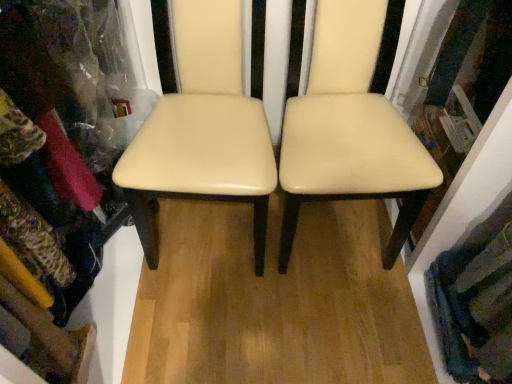
What do you see at coordinates (475, 301) in the screenshot? This screenshot has height=384, width=512. I see `textured wool scarf at lower right` at bounding box center [475, 301].

The width and height of the screenshot is (512, 384). What are the coordinates of `cream leather chair at center, placed as the second chair when sorted from right to left` in the screenshot? It's located at (202, 128).

Describe the element at coordinates (350, 129) in the screenshot. The height and width of the screenshot is (384, 512). I see `creamy leather chair at center, the 1th chair from the right` at that location.

You are a GUI agent. You are given a task and a screenshot of the screen. Output one action in this format:
    pyautogui.click(x=<x>, y=<y>)
    Task: Click on the textured wool scarf at lower right
    Image resolution: width=512 pixels, height=384 pixels.
    Given the screenshot: What is the action you would take?
    pyautogui.click(x=475, y=301)

Which is closer to the camera, (419, 183) or (450, 326)?

Point (419, 183) is closer to the camera than point (450, 326).

I want to click on clothing located below the creamy leather chair at center, which ranks as the 2th chair in left-to-right order (from the image's perspective), so click(x=475, y=301).

Is creamy leather chair at center, which ranks as the 2th chair in left-to-right order, surrounding textured wool scarf at lower right?

No, textured wool scarf at lower right is not a part of creamy leather chair at center, which ranks as the 2th chair in left-to-right order.

Looking at this image, is creamy leather chair at center, the 1th chair from the right, thinner than textured wool scarf at lower right?

No.

From the picture: Measure the distance from cream leather chair at center, placed as the second chair when sorted from right to left, to creamy leather chair at center, which ranks as the 2th chair in left-to-right order.

cream leather chair at center, placed as the second chair when sorted from right to left, is 10.68 inches away from creamy leather chair at center, which ranks as the 2th chair in left-to-right order.

In terms of width, does cream leather chair at center, which is counted as the 1th chair, starting from the left, look wider or thinner when compared to creamy leather chair at center, the 1th chair from the right?

cream leather chair at center, which is counted as the 1th chair, starting from the left, is thinner than creamy leather chair at center, the 1th chair from the right.

In the scene shown: Is cream leather chair at center, which is counted as the 1th chair, starting from the left, at the right side of creamy leather chair at center, which ranks as the 2th chair in left-to-right order?

Incorrect, cream leather chair at center, which is counted as the 1th chair, starting from the left, is not on the right side of creamy leather chair at center, which ranks as the 2th chair in left-to-right order.

Is cream leather chair at center, which is counted as the 1th chair, starting from the left, taller or shorter than creamy leather chair at center, which ranks as the 2th chair in left-to-right order?

In the image, cream leather chair at center, which is counted as the 1th chair, starting from the left, appears to be shorter than creamy leather chair at center, which ranks as the 2th chair in left-to-right order.

How far apart are textured wool scarf at lower right and creamy leather chair at center, which ranks as the 2th chair in left-to-right order?

textured wool scarf at lower right and creamy leather chair at center, which ranks as the 2th chair in left-to-right order, are 15.21 inches apart.

From the image's perspective, between textured wool scarf at lower right and creamy leather chair at center, the 1th chair from the right, which one is located above?

creamy leather chair at center, the 1th chair from the right, is shown above in the image.

Considering the positions of point (507, 348) and point (317, 50), is point (507, 348) closer or farther from the camera than point (317, 50)?

Point (507, 348) is positioned closer to the camera compared to point (317, 50).

Is there a large distance between textured wool scarf at lower right and creamy leather chair at center, which ranks as the 2th chair in left-to-right order?

textured wool scarf at lower right is actually quite close to creamy leather chair at center, which ranks as the 2th chair in left-to-right order.

Considering the sizes of objects textured wool scarf at lower right and cream leather chair at center, which is counted as the 1th chair, starting from the left, in the image provided, who is wider, textured wool scarf at lower right or cream leather chair at center, which is counted as the 1th chair, starting from the left,?

With larger width is cream leather chair at center, which is counted as the 1th chair, starting from the left.

Are textured wool scarf at lower right and cream leather chair at center, placed as the second chair when sorted from right to left, far apart?

They are positioned close to each other.

Is point (432, 305) closer or farther from the camera than point (219, 117)?

Clearly, point (432, 305) is more distant from the camera than point (219, 117).

Who is more distant, textured wool scarf at lower right or cream leather chair at center, which is counted as the 1th chair, starting from the left?

Positioned behind is textured wool scarf at lower right.

Are creamy leather chair at center, the 1th chair from the right, and cream leather chair at center, which is counted as the 1th chair, starting from the left, beside each other?

creamy leather chair at center, the 1th chair from the right, is not next to cream leather chair at center, which is counted as the 1th chair, starting from the left, and they're not touching.

Could you tell me if creamy leather chair at center, which ranks as the 2th chair in left-to-right order, is facing cream leather chair at center, placed as the second chair when sorted from right to left?

No, creamy leather chair at center, which ranks as the 2th chair in left-to-right order, does not turn towards cream leather chair at center, placed as the second chair when sorted from right to left.

Which object is positioned more to the right, creamy leather chair at center, the 1th chair from the right, or cream leather chair at center, placed as the second chair when sorted from right to left?

From the viewer's perspective, creamy leather chair at center, the 1th chair from the right, appears more on the right side.

From a real-world perspective, who is located higher, cream leather chair at center, which is counted as the 1th chair, starting from the left, or textured wool scarf at lower right?

From a 3D spatial view, cream leather chair at center, which is counted as the 1th chair, starting from the left, is above.

Is cream leather chair at center, which is counted as the 1th chair, starting from the left, taller or shorter than textured wool scarf at lower right?

cream leather chair at center, which is counted as the 1th chair, starting from the left, is taller than textured wool scarf at lower right.

Is cream leather chair at center, which is counted as the 1th chair, starting from the left, turned away from textured wool scarf at lower right?

cream leather chair at center, which is counted as the 1th chair, starting from the left, does not have its back to textured wool scarf at lower right.

From the image's perspective, is cream leather chair at center, which is counted as the 1th chair, starting from the left, on top of textured wool scarf at lower right?

Correct, cream leather chair at center, which is counted as the 1th chair, starting from the left, appears higher than textured wool scarf at lower right in the image.

You are a GUI agent. You are given a task and a screenshot of the screen. Output one action in this format:
    pyautogui.click(x=<x>, y=<y>)
    Task: Click on the chair that is the 2nd object above the textured wool scarf at lower right (from a real-world perspective)
    Image resolution: width=512 pixels, height=384 pixels.
    Given the screenshot: What is the action you would take?
    pos(350,129)

I want to click on chair below the cream leather chair at center, which is counted as the 1th chair, starting from the left (from the image's perspective), so click(x=350, y=129).

Estimate the real-world distances between objects in this image. Which object is closer to textured wool scarf at lower right, cream leather chair at center, which is counted as the 1th chair, starting from the left, or creamy leather chair at center, the 1th chair from the right?

A: Based on the image, creamy leather chair at center, the 1th chair from the right, appears to be nearer to textured wool scarf at lower right.

From the image, which object appears to be farther from cream leather chair at center, placed as the second chair when sorted from right to left, textured wool scarf at lower right or creamy leather chair at center, the 1th chair from the right?

textured wool scarf at lower right is positioned further to the anchor cream leather chair at center, placed as the second chair when sorted from right to left.

Estimate the real-world distances between objects in this image. Which object is closer to cream leather chair at center, which is counted as the 1th chair, starting from the left, creamy leather chair at center, the 1th chair from the right, or textured wool scarf at lower right?

creamy leather chair at center, the 1th chair from the right.

Based on their spatial positions, is creamy leather chair at center, the 1th chair from the right, or cream leather chair at center, which is counted as the 1th chair, starting from the left, closer to textured wool scarf at lower right?

creamy leather chair at center, the 1th chair from the right, is closer to textured wool scarf at lower right.

Looking at the image, which one is located closer to creamy leather chair at center, which ranks as the 2th chair in left-to-right order, textured wool scarf at lower right or cream leather chair at center, which is counted as the 1th chair, starting from the left?

cream leather chair at center, which is counted as the 1th chair, starting from the left, lies closer to creamy leather chair at center, which ranks as the 2th chair in left-to-right order, than the other object.

Estimate the real-world distances between objects in this image. Which object is further from creamy leather chair at center, the 1th chair from the right, cream leather chair at center, which is counted as the 1th chair, starting from the left, or textured wool scarf at lower right?

textured wool scarf at lower right lies further to creamy leather chair at center, the 1th chair from the right, than the other object.

Where is `chair located between cream leather chair at center, which is counted as the 1th chair, starting from the left, and textured wool scarf at lower right in the left-right direction`? Image resolution: width=512 pixels, height=384 pixels. chair located between cream leather chair at center, which is counted as the 1th chair, starting from the left, and textured wool scarf at lower right in the left-right direction is located at coordinates (350, 129).